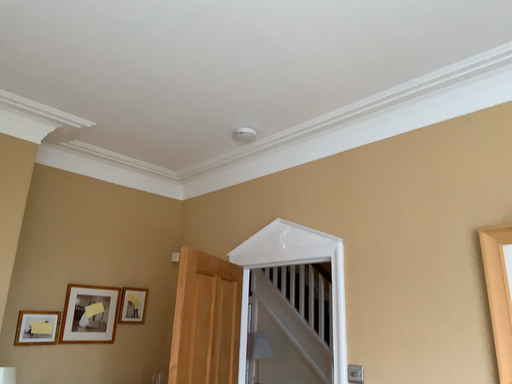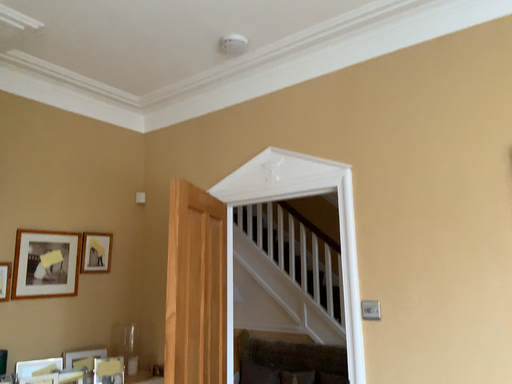
Question: Which way did the camera rotate in the video?

Choices:
 (A) rotated right
 (B) rotated left

Answer: (A)